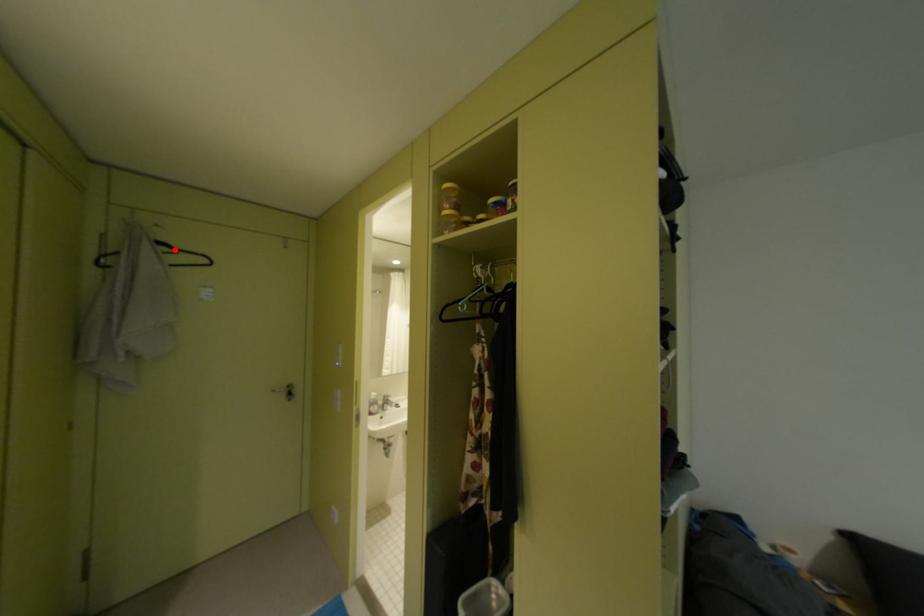
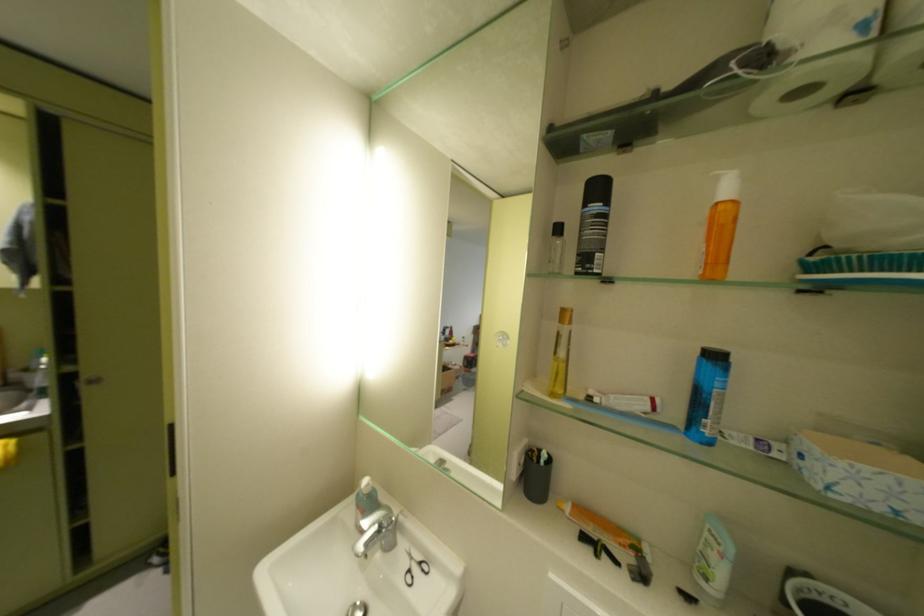
Question: I am providing you with two images of the same scene from different viewpoints. A red point is marked on the first image. At the location where the point appears in image 1, is it still visible in image 2?

Choices:
 (A) Yes
 (B) No

Answer: (B)